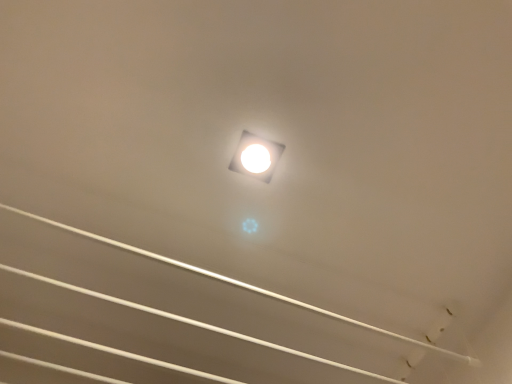
Question: Is white glossy square at center inside or outside of white glossy ceiling at center?

Choices:
 (A) outside
 (B) inside

Answer: (A)

Question: Is white glossy square at center bigger or smaller than white glossy ceiling at center?

Choices:
 (A) big
 (B) small

Answer: (B)

Question: Is white glossy square at center taller or shorter than white glossy ceiling at center?

Choices:
 (A) short
 (B) tall

Answer: (A)

Question: Looking at their shapes, would you say white glossy ceiling at center is wider or thinner than white glossy square at center?

Choices:
 (A) wide
 (B) thin

Answer: (A)

Question: From a real-world perspective, is white glossy ceiling at center positioned above or below white glossy square at center?

Choices:
 (A) above
 (B) below

Answer: (B)

Question: Visually, is white glossy ceiling at center positioned to the left or to the right of white glossy square at center?

Choices:
 (A) left
 (B) right

Answer: (A)

Question: Does point pos(400,377) appear closer or farther from the camera than point pos(241,139)?

Choices:
 (A) farther
 (B) closer

Answer: (A)